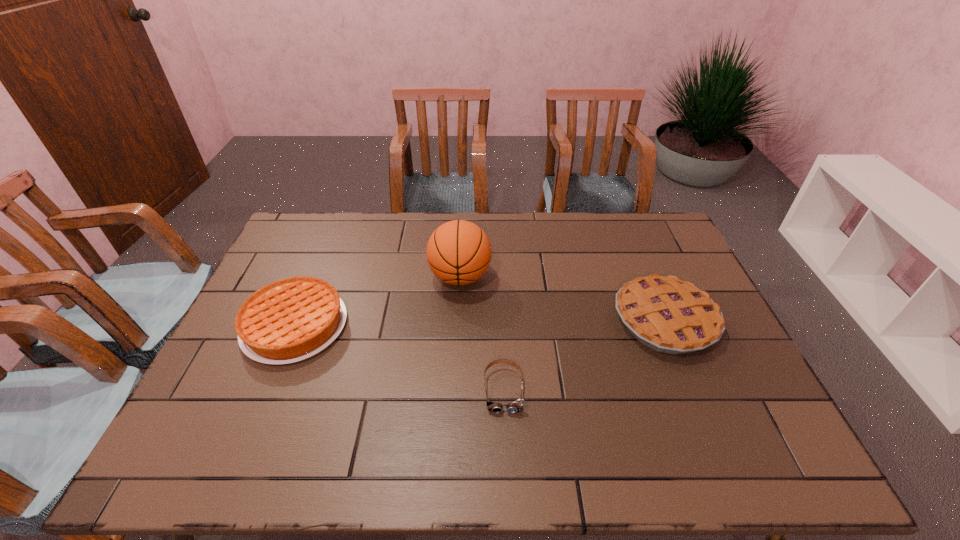
The width and height of the screenshot is (960, 540). In order to click on vacant point located between the basketball and the leftmost object in this screenshot , I will do `click(377, 301)`.

At what (x,y) coordinates should I click in order to perform the action: click on empty location between the leftmost object and the basketball. Please return your answer as a coordinate pair (x, y). Image resolution: width=960 pixels, height=540 pixels. Looking at the image, I should click on (377, 301).

Locate an element on the screen. Image resolution: width=960 pixels, height=540 pixels. vacant area that lies between the right pie and the goggles is located at coordinates (585, 355).

At what (x,y) coordinates should I click in order to perform the action: click on vacant area that lies between the rightmost object and the left pie. Please return your answer as a coordinate pair (x, y). Looking at the image, I should click on (480, 323).

At what (x,y) coordinates should I click in order to perform the action: click on free space between the shortest object and the rightmost object. Please return your answer as a coordinate pair (x, y). Image resolution: width=960 pixels, height=540 pixels. Looking at the image, I should click on (585, 355).

Identify which object is the second closest to the goggles. Please provide its 2D coordinates. Your answer should be formatted as a tuple, i.e. [(x, y)], where the tuple contains the x and y coordinates of a point satisfying the conditions above.

[(668, 315)]

The image size is (960, 540). I want to click on object that is the closest one to the left pie, so click(458, 252).

Locate an element on the screen. Image resolution: width=960 pixels, height=540 pixels. free space that satisfies the following two spatial constraints: 1. on the back side of the right pie; 2. on the left side of the left pie is located at coordinates (298, 320).

Identify the location of free point that satisfies the following two spatial constraints: 1. on the front side of the tallest object; 2. on the right side of the right pie. Image resolution: width=960 pixels, height=540 pixels. (458, 320).